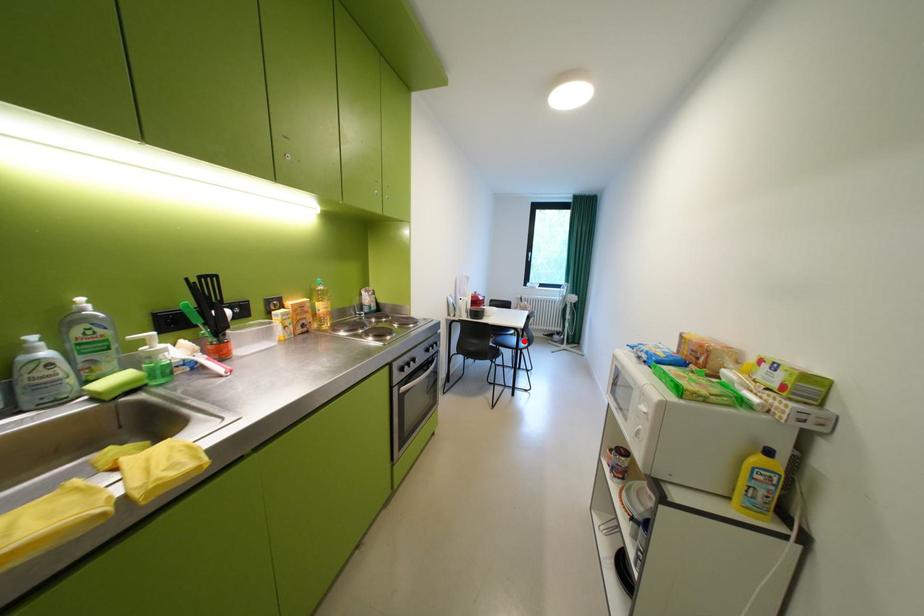
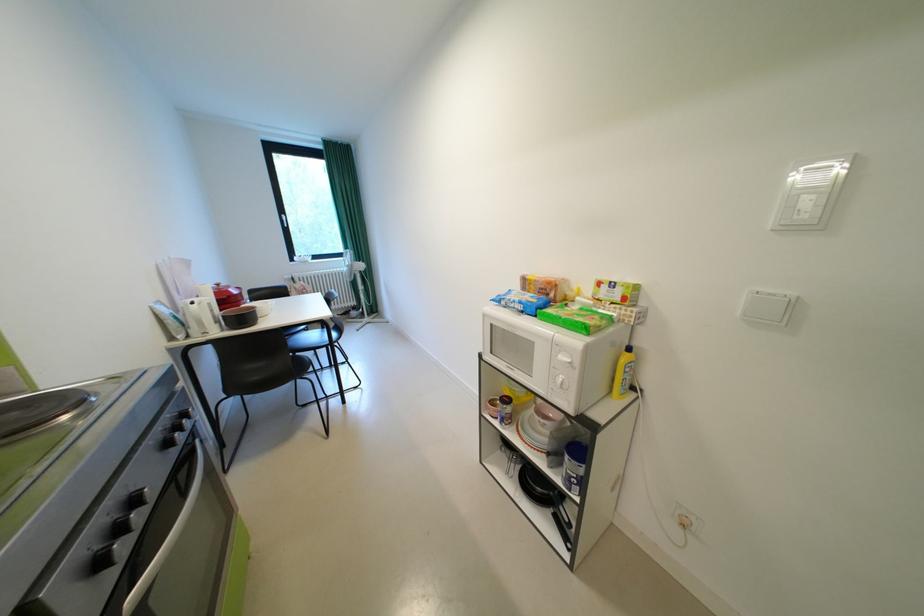
Find the pixel in the second image that matches the highlighted location in the first image.

(325, 337)